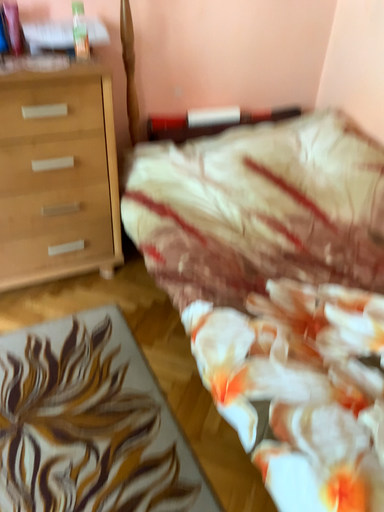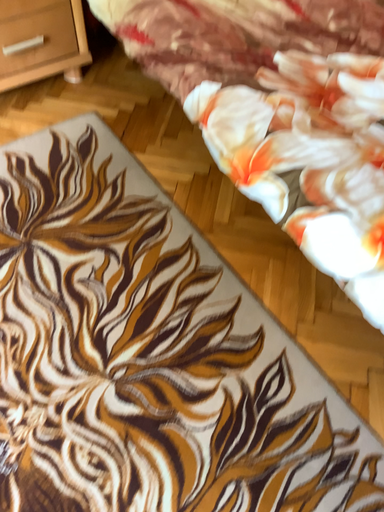
Question: How did the camera likely rotate when shooting the video?

Choices:
 (A) rotated left
 (B) rotated right

Answer: (B)